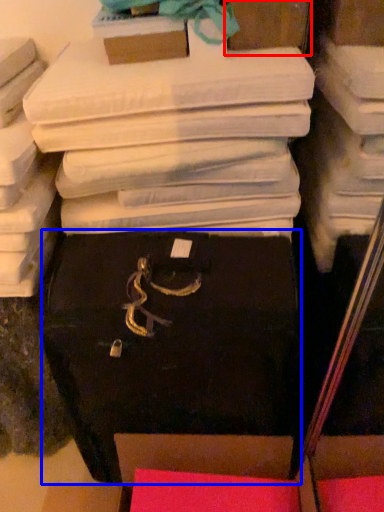
Question: Which of the following is the farthest to the observer, storage box (highlighted by a red box) or storage box (highlighted by a blue box)?

Choices:
 (A) storage box
 (B) storage box

Answer: (A)